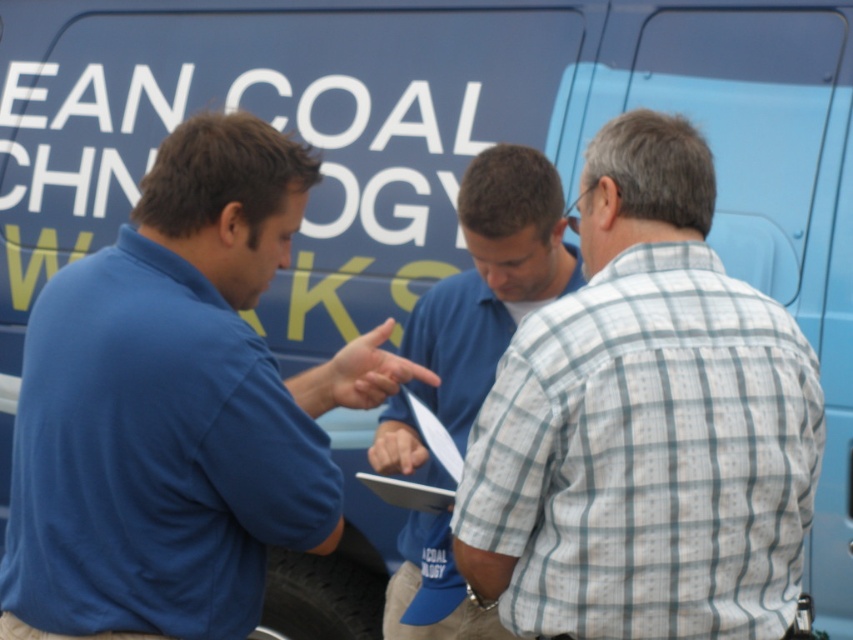
Based on the scene described, can you determine if the blue cotton shirt at left is wider than the white paper clipboard at center?

The blue cotton shirt at left is wider than the white paper clipboard at center according to the description.

You are a photographer trying to capture a clear shot of the text on the vehicle. The blue cotton shirt at left and the blue shirt at center are blocking part of the text. Which person should you ask to move to get a better view?

The blue cotton shirt at left is larger in size than blue shirt at center, so moving the blue cotton shirt at left would provide a clearer view of the obscured text.